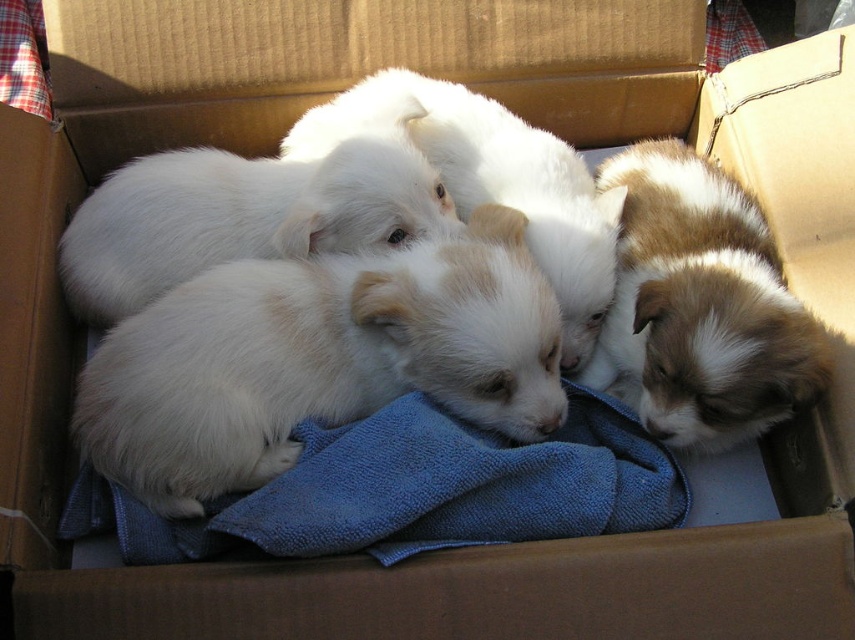
Question: Is brown and white fur at right positioned before white fluffy dog at center?

Choices:
 (A) no
 (B) yes

Answer: (B)

Question: Based on their relative distances, which object is farther from the white fluffy dog at center?

Choices:
 (A) brown and white fur at right
 (B) blue microfiber cloth at center
 (C) white fluffy puppies at center
 (D) white fluffy dog at upper left

Answer: (B)

Question: Can you confirm if blue microfiber cloth at center is positioned above brown and white fur at right?

Choices:
 (A) no
 (B) yes

Answer: (A)

Question: Observing the image, what is the correct spatial positioning of white fluffy puppies at center in reference to white fluffy dog at upper left?

Choices:
 (A) above
 (B) below

Answer: (B)

Question: Which of the following is the farthest from the observer?

Choices:
 (A) white fluffy dog at upper left
 (B) brown and white fur at right
 (C) white fluffy dog at center
 (D) blue microfiber cloth at center

Answer: (A)

Question: Which point is closer to the camera?

Choices:
 (A) blue microfiber cloth at center
 (B) white fluffy dog at center
 (C) white fluffy puppies at center

Answer: (A)